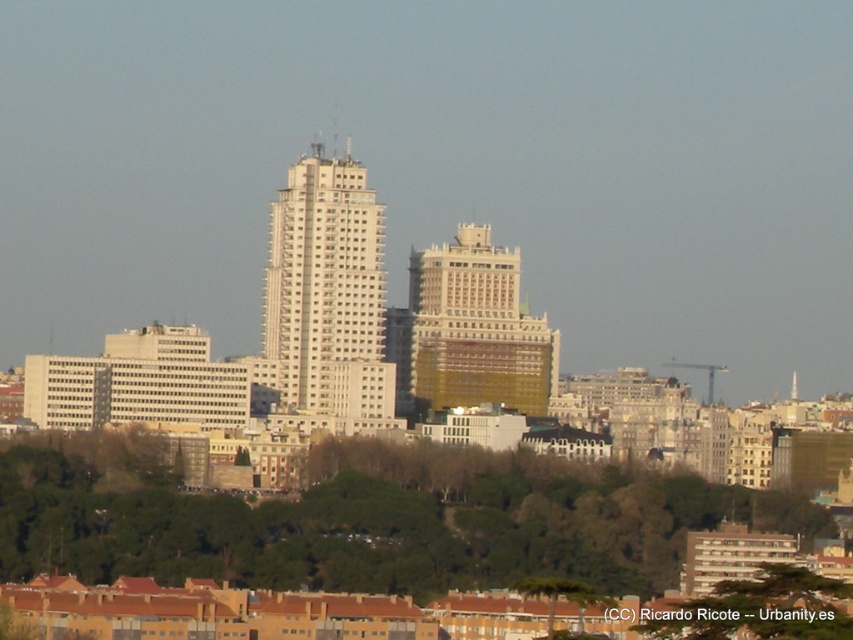
You are a city planner analyzing the layout of this area. Given the coordinates provided in the description, can you determine the position of the white smooth building at center relative to the other structures in the scene?

The white smooth building at center is located at point coordinates (326, 292), which places it centrally within the scene as described.

You are a drone operator trying to deliver a package to the point at coordinates point (x=368, y=518). The delivery area is surrounded by green leafy trees at lower center. Can you confirm if the point is within the delivery area?

The point (x=368, y=518) is on green leafy trees at lower center, so the delivery area is within the delivery area.